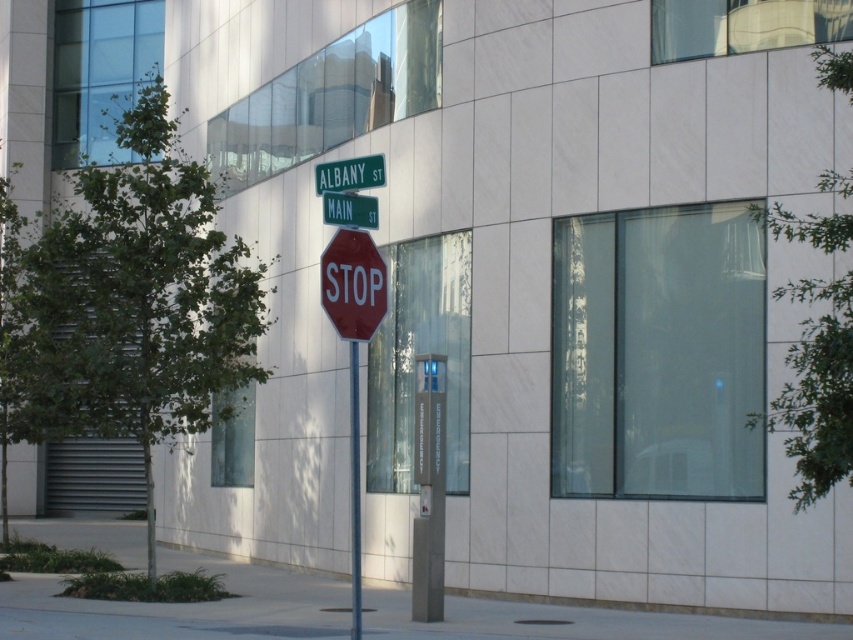
Question: Is metallic pole at center positioned before red stop sign at center?

Choices:
 (A) no
 (B) yes

Answer: (A)

Question: Does red glossy stop sign at center have a larger size compared to red matte stop sign at center?

Choices:
 (A) yes
 (B) no

Answer: (A)

Question: Which point is farther to the camera?

Choices:
 (A) (345, 230)
 (B) (357, 204)
 (C) (350, 460)
 (D) (323, 172)

Answer: (C)

Question: Is the position of metallic pole at center less distant than that of red stop sign at center?

Choices:
 (A) yes
 (B) no

Answer: (B)

Question: Considering the real-world distances, which object is farthest from the metallic pole at center?

Choices:
 (A) red glossy stop sign at center
 (B) red stop sign at center
 (C) red matte stop sign at center

Answer: (B)

Question: Which is nearer to the red stop sign at center?

Choices:
 (A) red matte stop sign at center
 (B) metallic pole at center

Answer: (A)